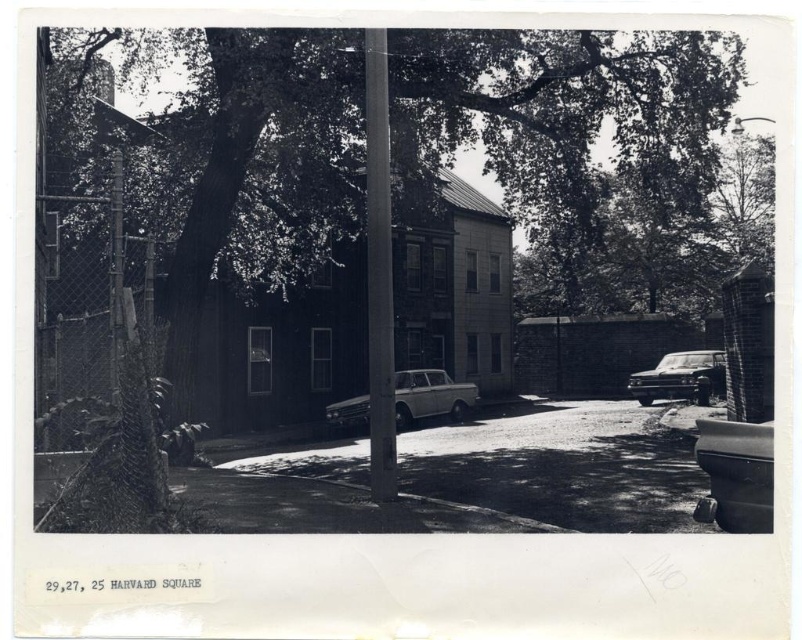
Question: Can you confirm if shiny silver sedan at right is wider than metallic chain-link fence at left?

Choices:
 (A) no
 (B) yes

Answer: (A)

Question: Does shiny silver sedan at right have a smaller size compared to metallic chain-link fence at left?

Choices:
 (A) yes
 (B) no

Answer: (A)

Question: Which object is positioned closest to the smooth bark tree at center?

Choices:
 (A) metallic pole at center
 (B) metallic silver station wagon at center

Answer: (B)

Question: Among these points, which one is nearest to the camera?

Choices:
 (A) (412, 388)
 (B) (687, 356)
 (C) (391, 440)
 (D) (120, 193)

Answer: (D)

Question: Is metallic pole at center further to the viewer compared to metallic chain-link fence at left?

Choices:
 (A) no
 (B) yes

Answer: (B)

Question: Which of these objects is positioned closest to the smooth bark tree at center?

Choices:
 (A) metallic silver station wagon at center
 (B) metallic pole at center

Answer: (A)